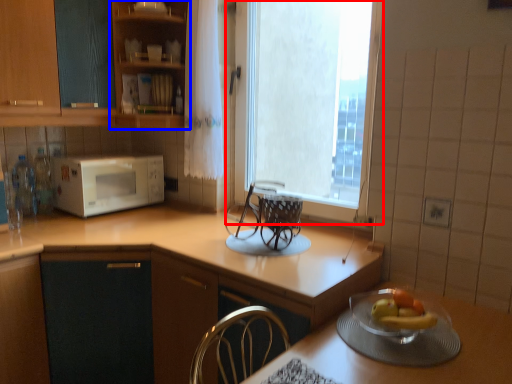
Question: Among these objects, which one is farthest to the camera, window (highlighted by a red box) or cabinetry (highlighted by a blue box)?

Choices:
 (A) window
 (B) cabinetry

Answer: (B)